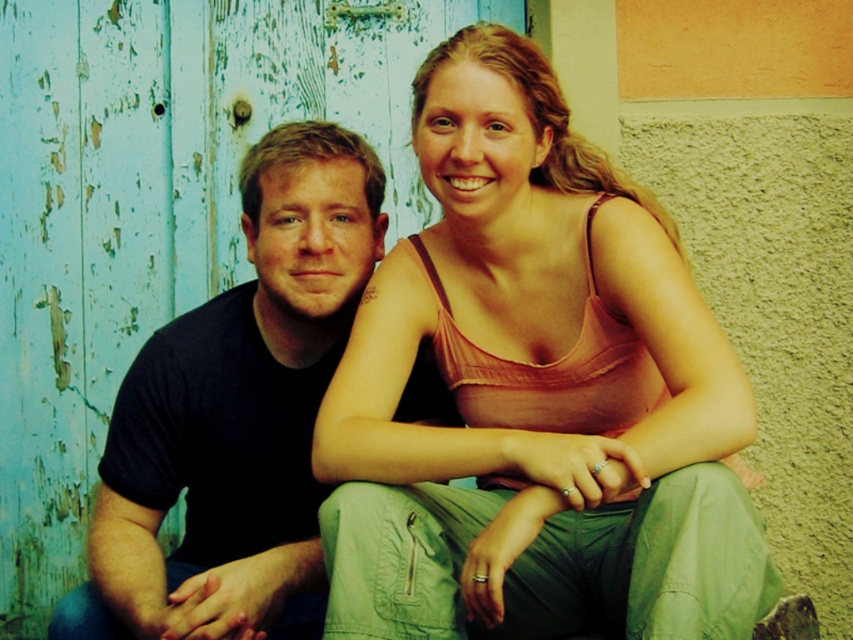
Question: Is matte orange tank top at center positioned at the back of black cotton shirt at left?

Choices:
 (A) no
 (B) yes

Answer: (A)

Question: Is matte orange tank top at center positioned at the back of black cotton shirt at left?

Choices:
 (A) no
 (B) yes

Answer: (A)

Question: Is matte orange tank top at center below black cotton shirt at left?

Choices:
 (A) no
 (B) yes

Answer: (A)

Question: Which object appears farthest from the camera in this image?

Choices:
 (A) matte orange tank top at center
 (B) black cotton shirt at left

Answer: (B)

Question: Which point is closer to the camera taking this photo?

Choices:
 (A) (393, 625)
 (B) (129, 484)

Answer: (A)